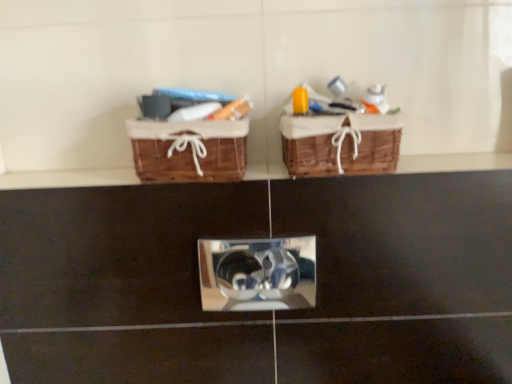
Question: Considering the relative positions of woven brown picnic basket at upper center, the second picnic basket when ordered from left to right, and woven brown picnic basket at upper center, which is counted as the first picnic basket, starting from the left, in the image provided, is woven brown picnic basket at upper center, the second picnic basket when ordered from left to right, to the left of woven brown picnic basket at upper center, which is counted as the first picnic basket, starting from the left, from the viewer's perspective?

Choices:
 (A) yes
 (B) no

Answer: (B)

Question: Considering the relative sizes of woven brown picnic basket at upper center, which is counted as the 1th picnic basket, starting from the right, and woven brown picnic basket at upper center, which appears as the 2th picnic basket when viewed from the right, in the image provided, is woven brown picnic basket at upper center, which is counted as the 1th picnic basket, starting from the right, smaller than woven brown picnic basket at upper center, which appears as the 2th picnic basket when viewed from the right,?

Choices:
 (A) no
 (B) yes

Answer: (A)

Question: Is woven brown picnic basket at upper center, the second picnic basket when ordered from left to right, taller than woven brown picnic basket at upper center, which is counted as the first picnic basket, starting from the left?

Choices:
 (A) yes
 (B) no

Answer: (A)

Question: Does woven brown picnic basket at upper center, which is counted as the 1th picnic basket, starting from the right, have a lesser width compared to woven brown picnic basket at upper center, which appears as the 2th picnic basket when viewed from the right?

Choices:
 (A) no
 (B) yes

Answer: (A)

Question: From the image's perspective, is woven brown picnic basket at upper center, which is counted as the 1th picnic basket, starting from the right, located above woven brown picnic basket at upper center, which is counted as the first picnic basket, starting from the left?

Choices:
 (A) yes
 (B) no

Answer: (A)

Question: Is woven brown picnic basket at upper center, which is counted as the first picnic basket, starting from the left, at the back of woven brown picnic basket at upper center, which is counted as the 1th picnic basket, starting from the right?

Choices:
 (A) yes
 (B) no

Answer: (B)

Question: Are woven brown picnic basket at upper center, which appears as the 2th picnic basket when viewed from the right, and woven brown picnic basket at upper center, the second picnic basket when ordered from left to right, making contact?

Choices:
 (A) no
 (B) yes

Answer: (A)

Question: Are woven brown picnic basket at upper center, which is counted as the first picnic basket, starting from the left, and woven brown picnic basket at upper center, the second picnic basket when ordered from left to right, located far from each other?

Choices:
 (A) no
 (B) yes

Answer: (A)

Question: Does woven brown picnic basket at upper center, which appears as the 2th picnic basket when viewed from the right, have a lesser width compared to woven brown picnic basket at upper center, the second picnic basket when ordered from left to right?

Choices:
 (A) yes
 (B) no

Answer: (A)

Question: Is woven brown picnic basket at upper center, which is counted as the first picnic basket, starting from the left, further to camera compared to woven brown picnic basket at upper center, the second picnic basket when ordered from left to right?

Choices:
 (A) yes
 (B) no

Answer: (A)

Question: From a real-world perspective, is woven brown picnic basket at upper center, which appears as the 2th picnic basket when viewed from the right, positioned under woven brown picnic basket at upper center, which is counted as the 1th picnic basket, starting from the right, based on gravity?

Choices:
 (A) no
 (B) yes

Answer: (B)

Question: Is woven brown picnic basket at upper center, which is counted as the first picnic basket, starting from the left, to the right of woven brown picnic basket at upper center, the second picnic basket when ordered from left to right, from the viewer's perspective?

Choices:
 (A) yes
 (B) no

Answer: (B)

Question: Is woven brown picnic basket at upper center, which is counted as the 1th picnic basket, starting from the right, inside or outside of woven brown picnic basket at upper center, which appears as the 2th picnic basket when viewed from the right?

Choices:
 (A) outside
 (B) inside

Answer: (A)